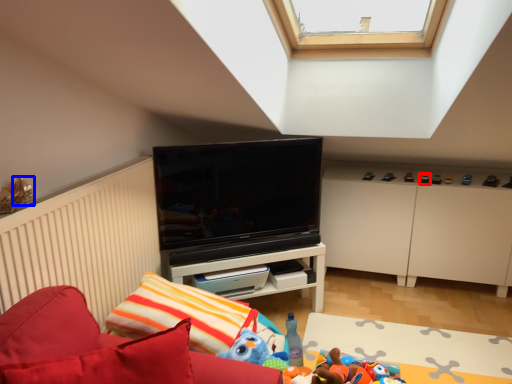
Question: Which object is closer to the camera taking this photo, toy (highlighted by a red box) or toy (highlighted by a blue box)?

Choices:
 (A) toy
 (B) toy

Answer: (B)